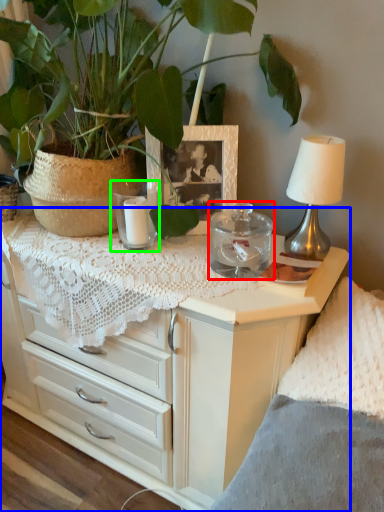
Question: Based on their relative distances, which object is nearer to candle holder (highlighted by a red box)? Choose from chest of drawers (highlighted by a blue box) and candle holder (highlighted by a green box).

Choices:
 (A) chest of drawers
 (B) candle holder

Answer: (B)